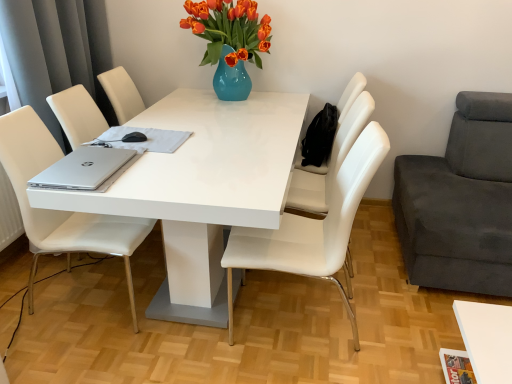
What are the coordinates of `free space that is in between white leather chair at center, the 3th chair in the right-to-left sequence, and white leather chair at center, placed as the 2th chair when sorted from right to left` in the screenshot? It's located at (298, 285).